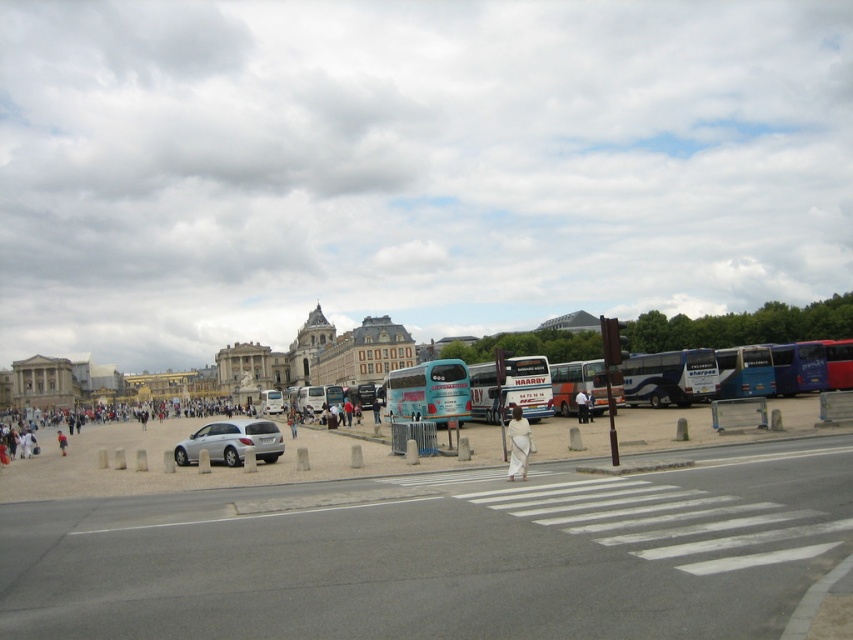
You are a city planner assessing the space in the image. The concrete plaza at center and the satin silver sedan at center are both in the central area. If you need to accommodate a new large event requiring more open space, which object would you consider relocating to free up more area?

The satin silver sedan at center should be relocated because the concrete plaza at center is wider, meaning the sedan occupies less space and is easier to move to free up more area.

You are a city planner analyzing the layout of this urban space. Considering the concrete plaza at center and the blue metallic tour bus at center, which one is positioned lower in the image?

The concrete plaza at center is located below the blue metallic tour bus at center, so the concrete plaza at center is positioned lower in the image.